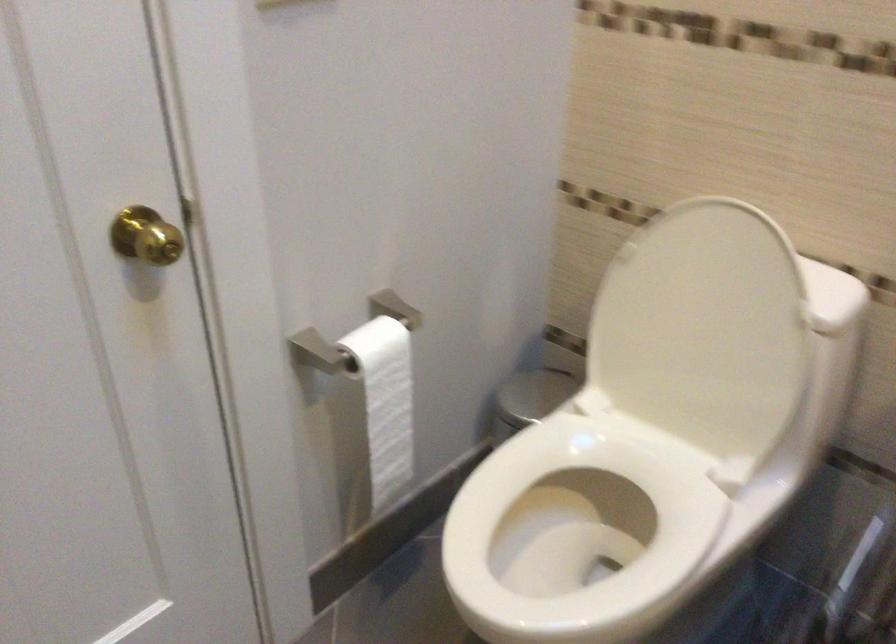
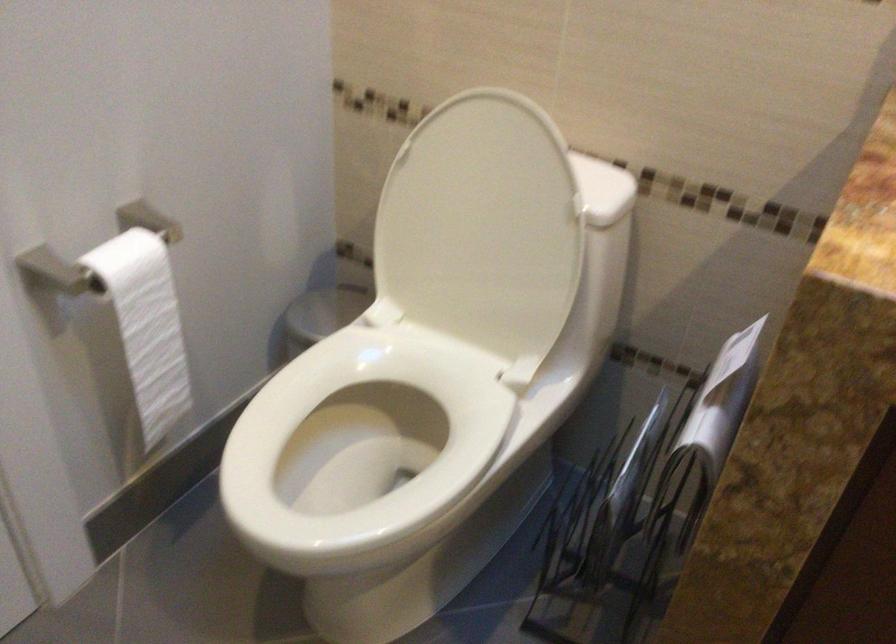
The point at (386, 400) is marked in the first image. Where is the corresponding point in the second image?

(147, 325)